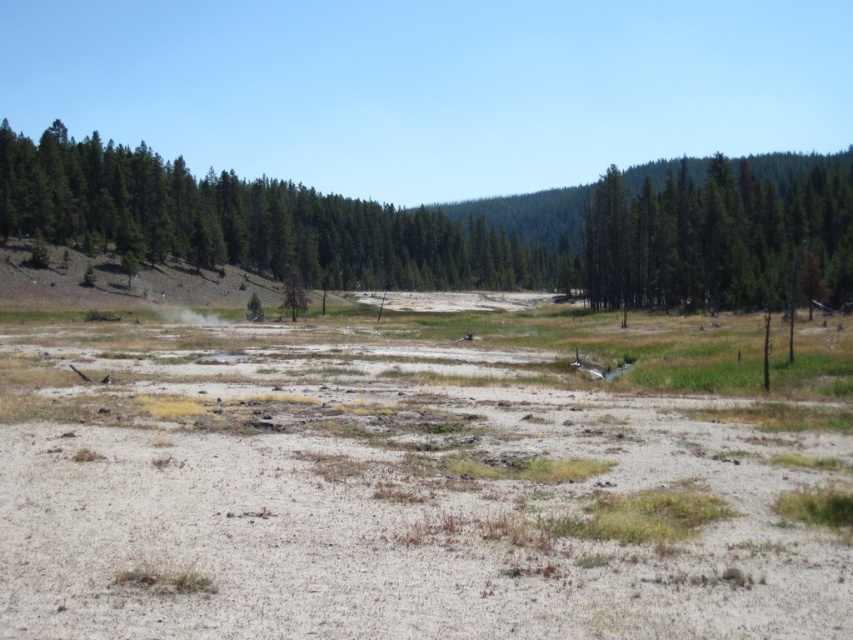
Question: Which object appears farthest from the camera in this image?

Choices:
 (A) green matte tree at upper right
 (B) green matte tree at upper left
 (C) dull gray sand at center
 (D) white vapor at center

Answer: (B)

Question: Which of the following is the farthest from the observer?

Choices:
 (A) (683, 228)
 (B) (164, 314)

Answer: (A)

Question: Can you confirm if dull gray sand at center is smaller than green matte tree at upper left?

Choices:
 (A) no
 (B) yes

Answer: (B)

Question: Which point is closer to the camera?

Choices:
 (A) green matte tree at upper left
 (B) green matte tree at upper right
 (C) white vapor at center

Answer: (B)

Question: Is dull gray sand at center closer to the viewer compared to white vapor at center?

Choices:
 (A) yes
 (B) no

Answer: (A)

Question: Is dull gray sand at center behind white vapor at center?

Choices:
 (A) no
 (B) yes

Answer: (A)